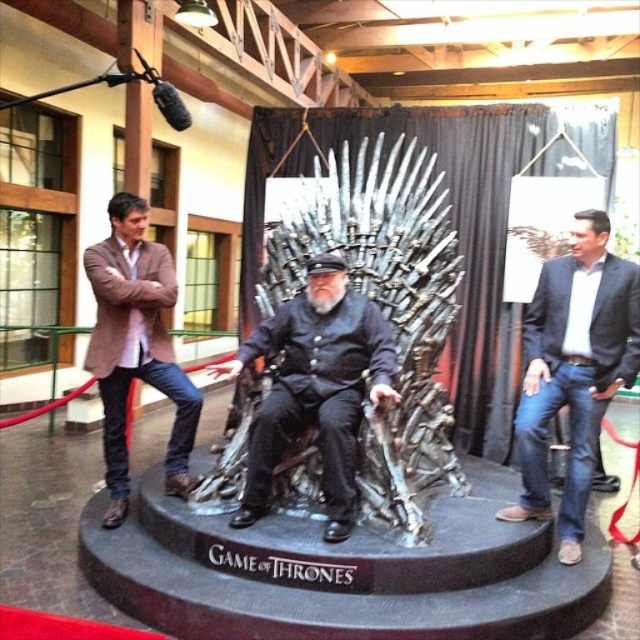
Is point (412, 164) positioned before point (384, 380)?

No.

Can you confirm if ironmetallicthrone at center is positioned above dark gray fabric coat at center?

Indeed, ironmetallicthrone at center is positioned over dark gray fabric coat at center.

Describe the element at coordinates (384, 307) in the screenshot. The height and width of the screenshot is (640, 640). I see `ironmetallicthrone at center` at that location.

I want to click on ironmetallicthrone at center, so click(x=384, y=307).

Does ironmetallicthrone at center have a lesser height compared to dark blue jeans at right?

In fact, ironmetallicthrone at center may be taller than dark blue jeans at right.

Is ironmetallicthrone at center positioned before dark blue jeans at right?

Yes, it is in front of dark blue jeans at right.

Is point (385, 182) positioned in front of point (592, 456)?

No, it is not.

You are a GUI agent. You are given a task and a screenshot of the screen. Output one action in this format:
    pyautogui.click(x=<x>, y=<y>)
    Task: Click on the ironmetallicthrone at center
    The width and height of the screenshot is (640, 640).
    Given the screenshot: What is the action you would take?
    pyautogui.click(x=384, y=307)

Does dark gray fabric coat at center lie in front of brown woolen blazer at left?

Yes, dark gray fabric coat at center is in front of brown woolen blazer at left.

Is the position of dark gray fabric coat at center more distant than that of brown woolen blazer at left?

Answer: That is False.

Is point (376, 310) in front of point (154, 323)?

Yes, point (376, 310) is in front of point (154, 323).

What are the coordinates of `dark gray fabric coat at center` in the screenshot? It's located at (316, 387).